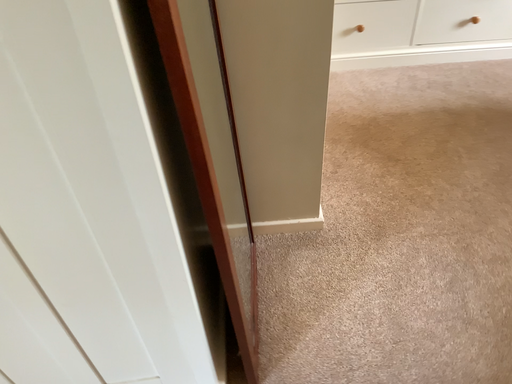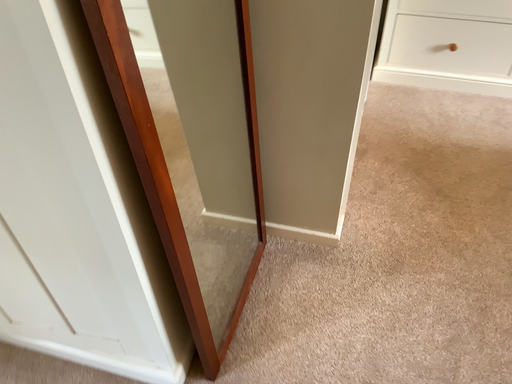
Question: How did the camera likely rotate when shooting the video?

Choices:
 (A) rotated left
 (B) rotated right

Answer: (A)